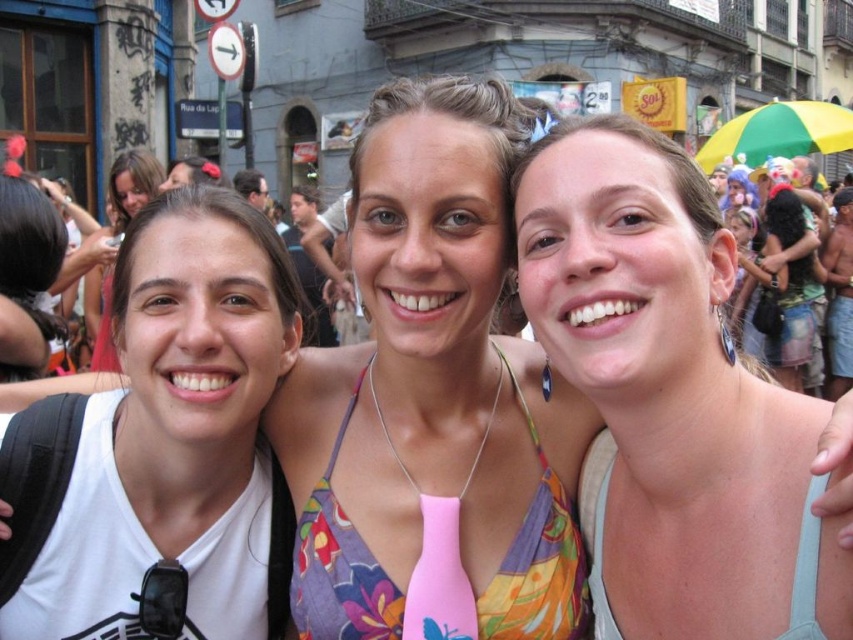
Where is `pink fabric top at center`? This screenshot has height=640, width=853. pink fabric top at center is located at coordinates (663, 385).

Between point (770, 538) and point (105, 296), which one is positioned behind?

Positioned behind is point (105, 296).

Image resolution: width=853 pixels, height=640 pixels. In order to click on pink fabric top at center in this screenshot , I will do `click(663, 385)`.